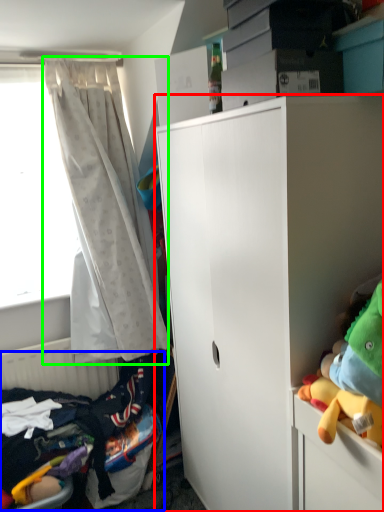
Question: Estimate the real-world distances between objects in this image. Which object is closer to cabinetry (highlighted by a red box), bed (highlighted by a blue box) or curtain (highlighted by a green box)?

Choices:
 (A) bed
 (B) curtain

Answer: (B)